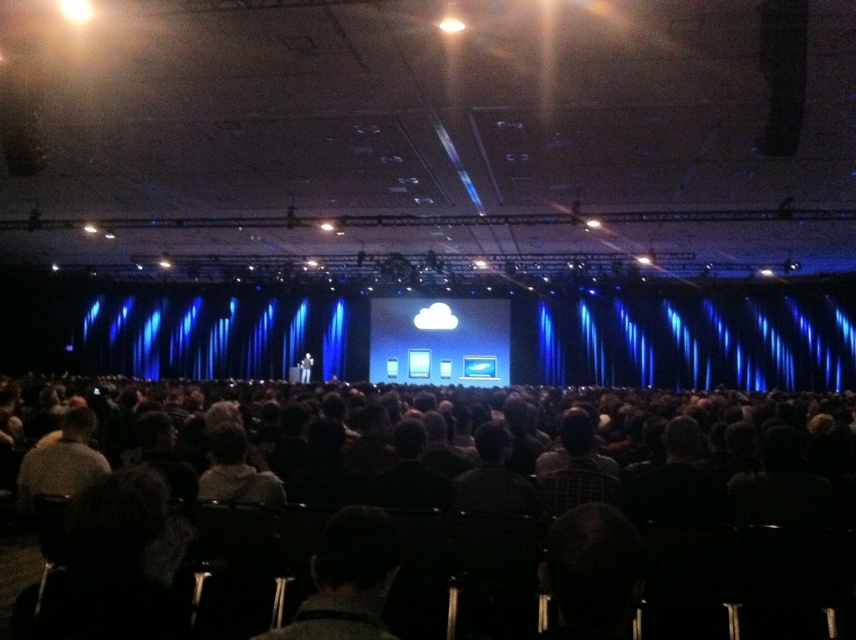
Question: Which point is closer to the camera?

Choices:
 (A) (804, 552)
 (B) (304, 355)
 (C) (367, 570)

Answer: (C)

Question: Is dark woolen sweater at center below dark suit at center?

Choices:
 (A) no
 (B) yes

Answer: (A)

Question: Which point appears farthest from the camera in this image?

Choices:
 (A) (301, 371)
 (B) (331, 572)

Answer: (A)

Question: Is dark gray chairs at center above dark woolen sweater at center?

Choices:
 (A) yes
 (B) no

Answer: (B)

Question: Does dark gray chairs at center have a greater width compared to dark suit at center?

Choices:
 (A) no
 (B) yes

Answer: (B)

Question: Which point is farther to the camera?

Choices:
 (A) (313, 620)
 (B) (233, 502)
 (C) (306, 362)

Answer: (C)